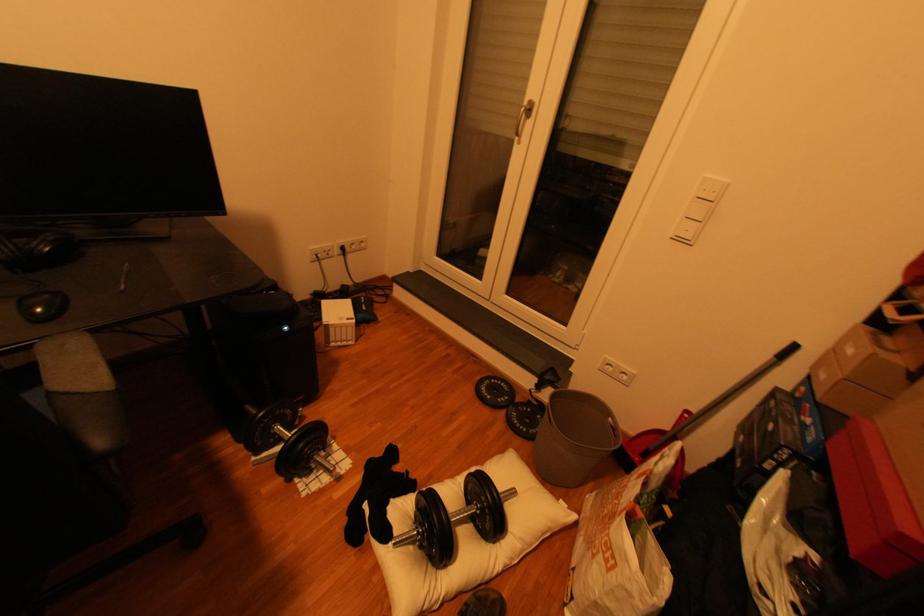
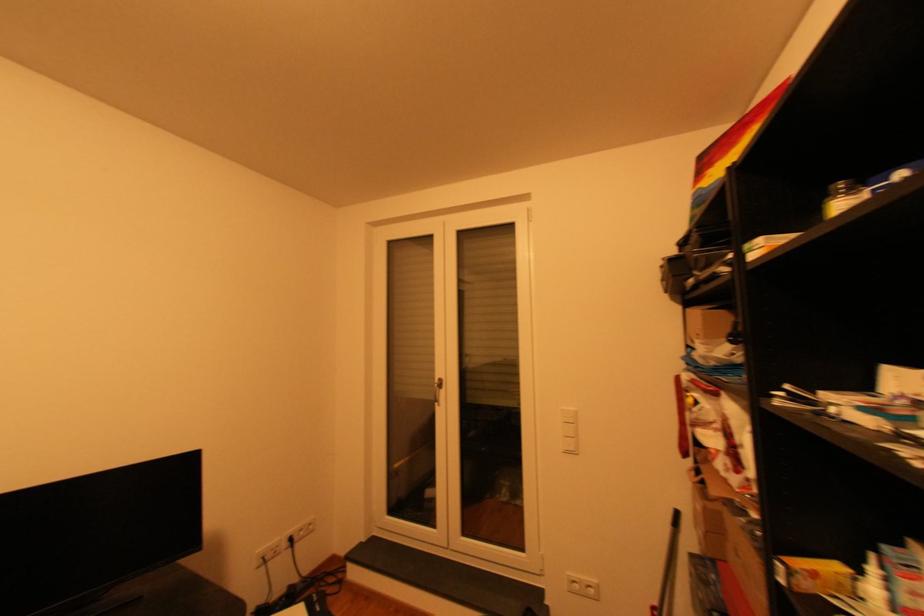
Locate, in the second image, the point that corresponds to [687,240] in the first image.

(576, 453)